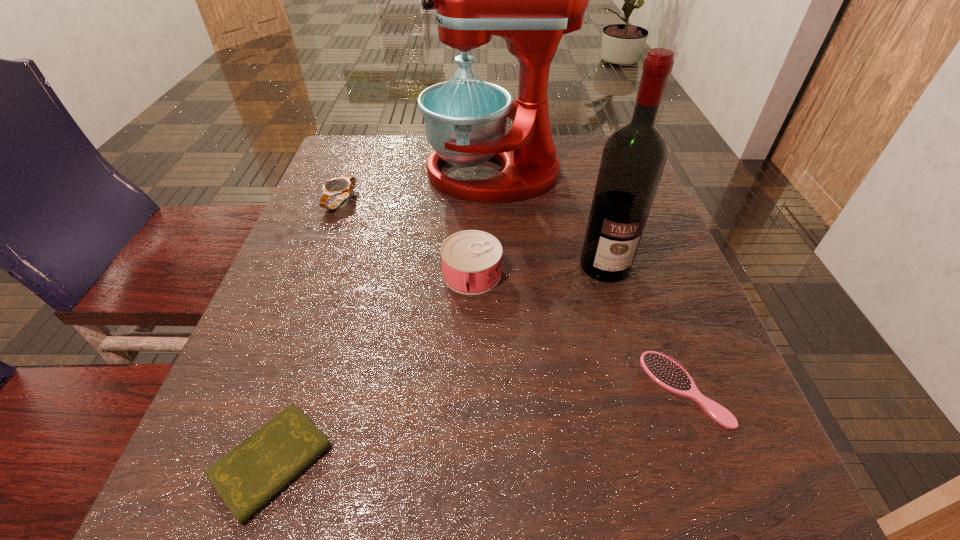
Where is `empty space that is in between the mixer and the alcohol`? empty space that is in between the mixer and the alcohol is located at coordinates (549, 219).

Where is `vacant point located between the alcohol and the third tallest object`? This screenshot has height=540, width=960. vacant point located between the alcohol and the third tallest object is located at coordinates (539, 270).

This screenshot has height=540, width=960. Find the location of `free space between the diary and the alcohol`. free space between the diary and the alcohol is located at coordinates (439, 364).

Image resolution: width=960 pixels, height=540 pixels. What are the coordinates of `vacant point located between the fifth tallest object and the mixer` in the screenshot? It's located at (589, 281).

You are a GUI agent. You are given a task and a screenshot of the screen. Output one action in this format:
    pyautogui.click(x=<x>, y=<y>)
    Task: Click on the vacant region between the alcohol and the hairbrush
    Image resolution: width=960 pixels, height=540 pixels.
    Given the screenshot: What is the action you would take?
    pyautogui.click(x=644, y=327)

The height and width of the screenshot is (540, 960). In order to click on free space between the diary and the mixer in this screenshot , I will do `click(383, 318)`.

Identify the location of vacant area between the alcohol and the fifth tallest object. (644, 327).

This screenshot has width=960, height=540. What are the coordinates of `unoccupied position between the mixer and the second shortest object` in the screenshot? It's located at (589, 281).

Where is `object identified as the second closest to the third tallest object`? Image resolution: width=960 pixels, height=540 pixels. object identified as the second closest to the third tallest object is located at coordinates (531, 0).

At what (x,y) coordinates should I click in order to perform the action: click on object that is the second closest to the can. Please return your answer as a coordinate pair (x, y). Image resolution: width=960 pixels, height=540 pixels. Looking at the image, I should click on (531, 0).